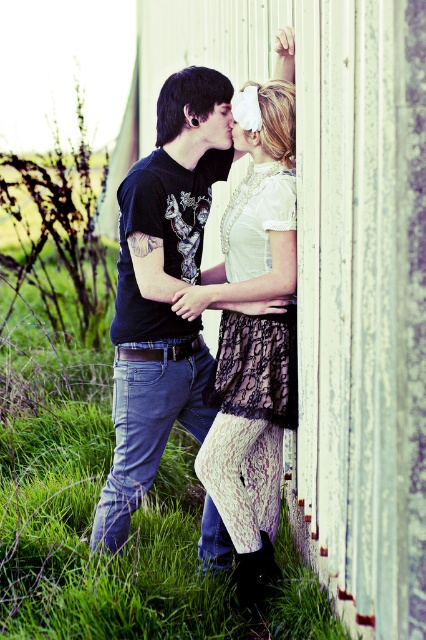
You are standing in the scene and want to locate the white painted wood at upper center. Which coordinate point should you look at?

You should look at the coordinate point at [340,273] to find the white painted wood at upper center.